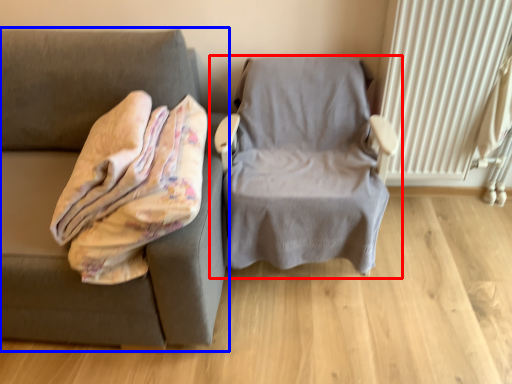
Question: Among these objects, which one is nearest to the camera, chair (highlighted by a red box) or studio couch (highlighted by a blue box)?

Choices:
 (A) chair
 (B) studio couch

Answer: (B)